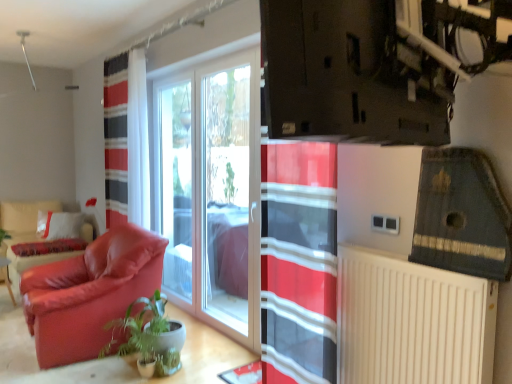
Question: From the image's perspective, is green glossy plant at lower left above or below matte leather armchair at left?

Choices:
 (A) below
 (B) above

Answer: (A)

Question: From a real-world perspective, is green glossy plant at lower left above or below matte leather armchair at left?

Choices:
 (A) below
 (B) above

Answer: (A)

Question: Considering the real-world distances, which object is closest to the green glossy plant at lower left?

Choices:
 (A) white plastic radiator at lower right
 (B) velvet red armchair at left
 (C) matte leather armchair at left
 (D) transparent glass window at center

Answer: (B)

Question: Which object is positioned closest to the velvet red armchair at left?

Choices:
 (A) white plastic radiator at lower right
 (B) green glossy plant at lower left
 (C) matte leather armchair at left
 (D) transparent glass window at center

Answer: (B)